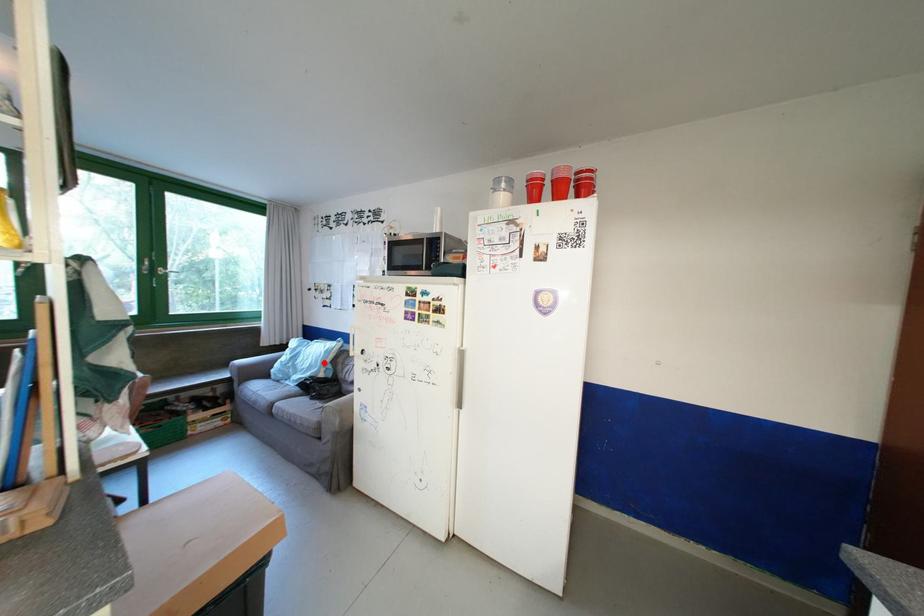
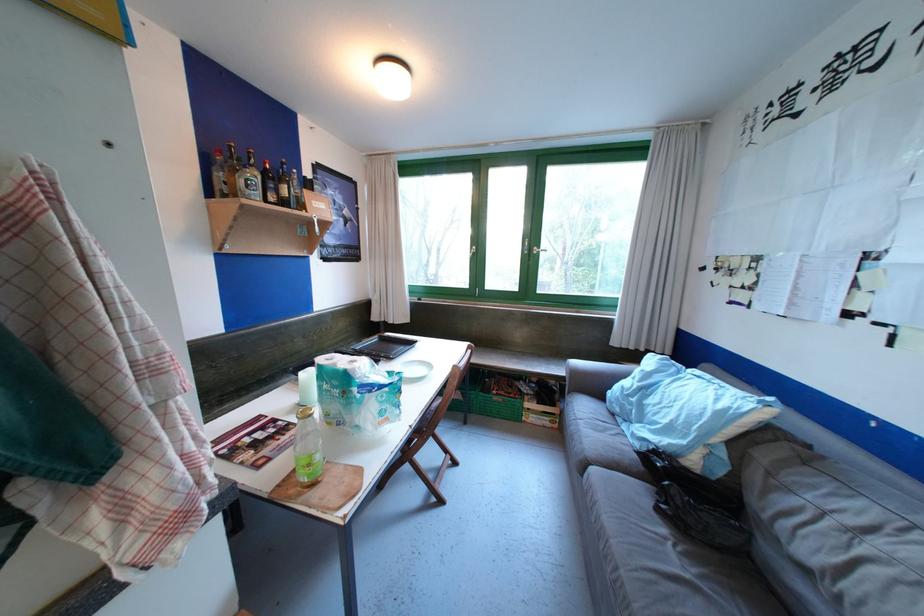
Question: A red point is marked in image1. In image2, is the corresponding 3D point closer to the camera or farther? Reply with the corresponding letter.

Choices:
 (A) The corresponding 3D point is closer.
 (B) The corresponding 3D point is farther.

Answer: (A)